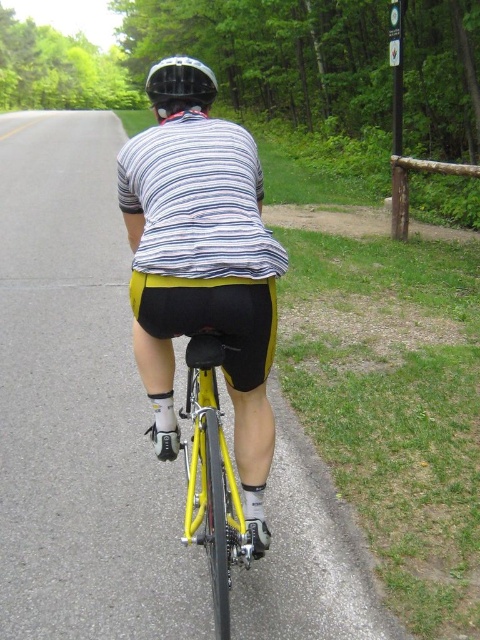
Locate an element on the screen. Image resolution: width=480 pixels, height=640 pixels. yellow matte bicycle at center is located at coordinates (212, 480).

Which is behind, point (192, 417) or point (144, 88)?

Point (144, 88)

You are a GUI agent. You are given a task and a screenshot of the screen. Output one action in this format:
    pyautogui.click(x=<x>, y=<y>)
    Task: Click on the yellow matte bicycle at center
    
    Given the screenshot: What is the action you would take?
    pyautogui.click(x=212, y=480)